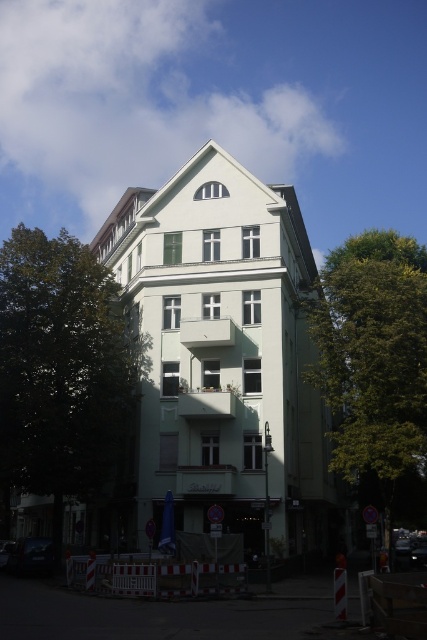
Is green leafy tree at left in front of green leafy tree at center?

No, it is behind green leafy tree at center.

Based on the photo, who is shorter, green leafy tree at left or green leafy tree at center?

green leafy tree at center

Describe the element at coordinates (61, 372) in the screenshot. I see `green leafy tree at left` at that location.

This screenshot has height=640, width=427. Find the location of `green leafy tree at left`. green leafy tree at left is located at coordinates (61, 372).